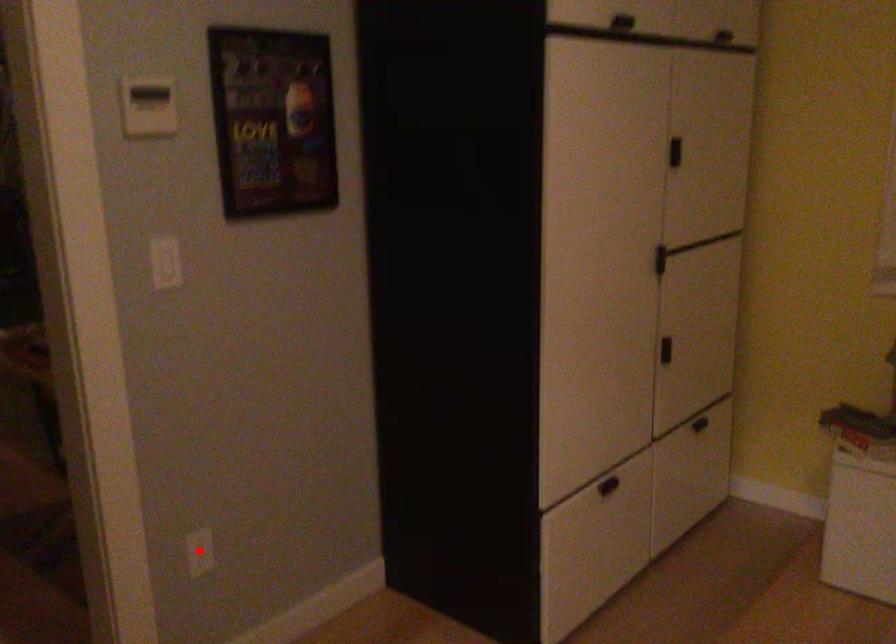
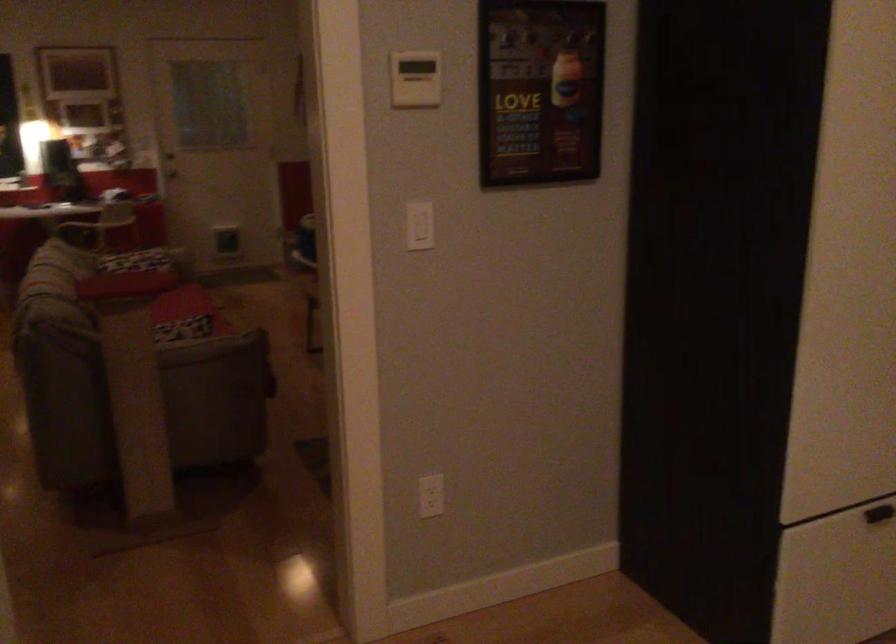
Find the pixel in the second image that matches the highlighted location in the first image.

(431, 496)